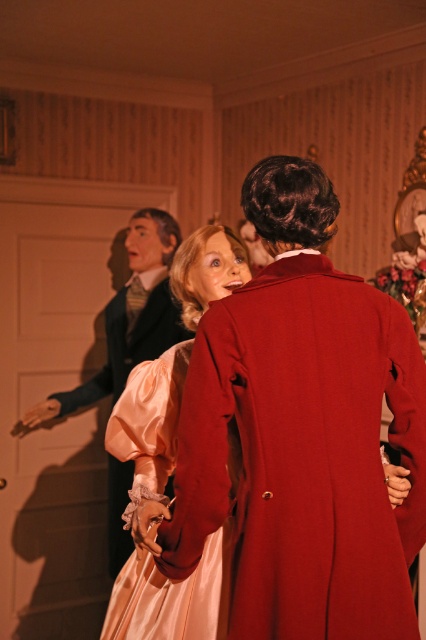
Question: Can you confirm if matte black coat at left is positioned to the right of satin pink dress at center?

Choices:
 (A) no
 (B) yes

Answer: (B)

Question: Which object is the closest to the satin pink dress at center?

Choices:
 (A) matte black coat at left
 (B) silky pink dress at center
 (C) silky peach dress at center

Answer: (A)

Question: Which of the following is the closest to the observer?

Choices:
 (A) matte black coat at left
 (B) satin pink dress at center

Answer: (B)

Question: Can you confirm if silky peach dress at center is bigger than matte black coat at left?

Choices:
 (A) no
 (B) yes

Answer: (A)

Question: Can you confirm if silky pink dress at center is positioned below silky peach dress at center?

Choices:
 (A) yes
 (B) no

Answer: (B)

Question: Which of the following is the farthest from the observer?

Choices:
 (A) (120, 540)
 (B) (118, 432)
 (C) (108, 394)
 (D) (192, 509)

Answer: (C)